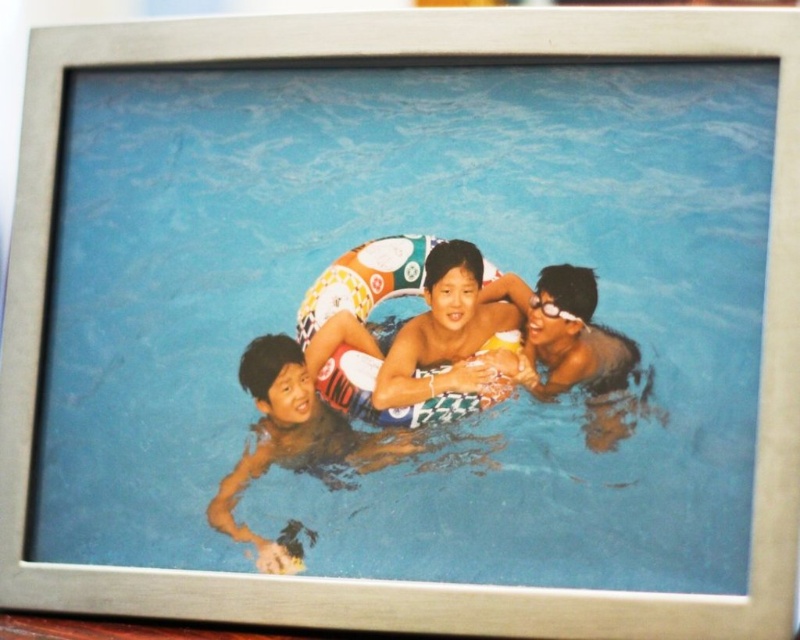
Can you confirm if smooth yellow lifebuoy at center is positioned above glossy black swimmer at center?

Indeed, smooth yellow lifebuoy at center is positioned over glossy black swimmer at center.

Between smooth yellow lifebuoy at center and glossy black swimmer at center, which one appears on the left side from the viewer's perspective?

smooth yellow lifebuoy at center

The image size is (800, 640). I want to click on smooth yellow lifebuoy at center, so click(449, 337).

You are a GUI agent. You are given a task and a screenshot of the screen. Output one action in this format:
    pyautogui.click(x=<x>, y=<y>)
    Task: Click on the smooth yellow lifebuoy at center
    The width and height of the screenshot is (800, 640).
    Given the screenshot: What is the action you would take?
    pyautogui.click(x=449, y=337)

Does smooth skin boy at center have a larger size compared to smooth yellow lifebuoy at center?

Yes, smooth skin boy at center is bigger than smooth yellow lifebuoy at center.

Can you confirm if smooth skin boy at center is positioned to the right of smooth yellow lifebuoy at center?

In fact, smooth skin boy at center is to the left of smooth yellow lifebuoy at center.

Where is `smooth skin boy at center`? The image size is (800, 640). smooth skin boy at center is located at coordinates (296, 432).

Which is more to the left, smooth skin boy at center or glossy black swimmer at center?

smooth skin boy at center is more to the left.

Is smooth skin boy at center smaller than glossy black swimmer at center?

No, smooth skin boy at center is not smaller than glossy black swimmer at center.

Between point (318, 442) and point (612, 417), which one is positioned in front?

Point (612, 417)

The width and height of the screenshot is (800, 640). In order to click on smooth skin boy at center in this screenshot , I will do `click(296, 432)`.